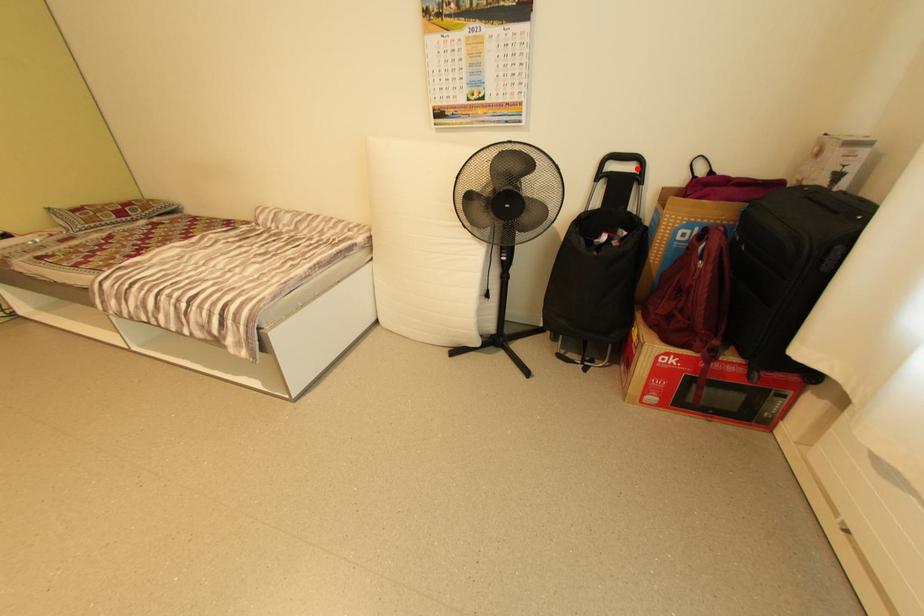
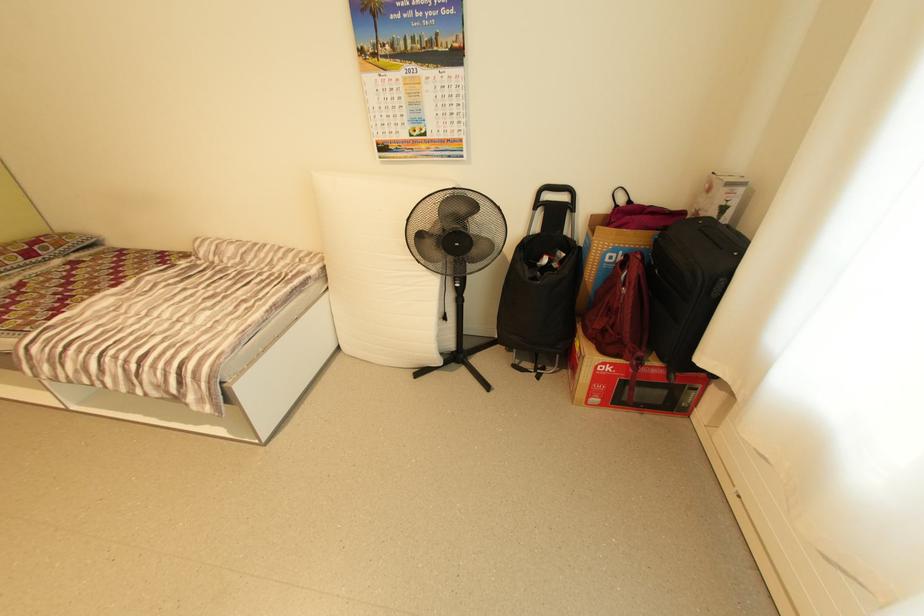
In the second image, find the point that corresponds to the highlighted location in the first image.

(570, 198)